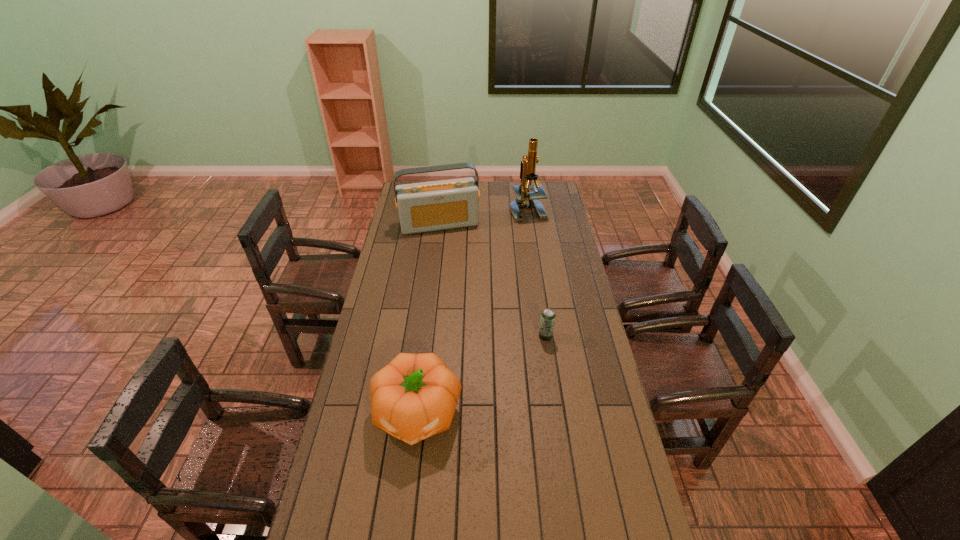
Where is `free space on the desktop that is between the nearest object and the third farthest object and is positioned on the front-facing side of the second tallest object`? The height and width of the screenshot is (540, 960). free space on the desktop that is between the nearest object and the third farthest object and is positioned on the front-facing side of the second tallest object is located at coordinates (x=481, y=375).

The image size is (960, 540). Identify the location of free space on the desktop that is between the third tallest object and the shortest object and is positioned at the eyepiece of the tallest object. (469, 382).